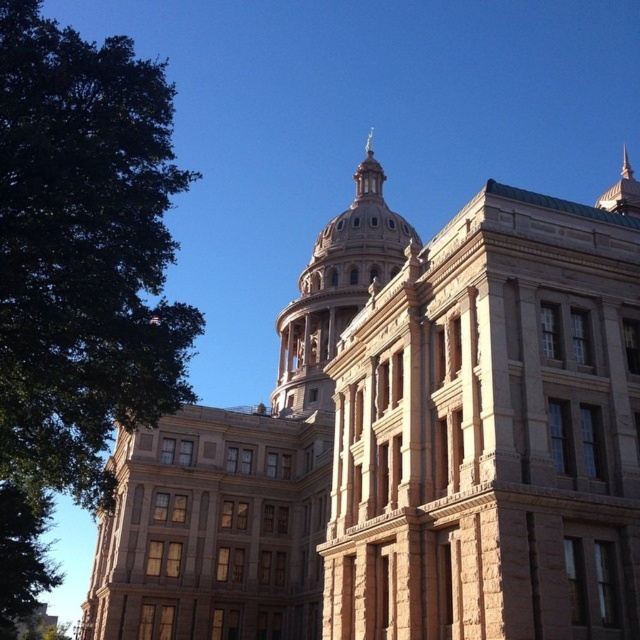
In the scene shown: You are an architect planning to add a new tree sculpture in front of the historic building. The sculpture must be the same size as the green leafy tree at left. Can you confirm if the sculpture will be smaller than the golden stone dome at center?

The green leafy tree at left is smaller than the golden stone dome at center, so the sculpture will also be smaller than the golden stone dome at center.

You are standing in front of the historic building and notice two points marked on the dome. The first point is at coordinates point (157, 362) and the second is at point (316, 250). Which of these two points is closer to your current position?

Point (157, 362) is closer to the camera than point (316, 250), so the first point is closer to your current position.

You are a visitor standing in front of the historic building and want to take a photo that includes both the green leafy tree at left and the green leafy tree at lower left. Which tree should you move closer to in order to capture both trees fully in your camera frame?

You should move closer to the green leafy tree at left because it is narrower than the green leafy tree at lower left. This allows you to include both trees within the frame without cropping either.